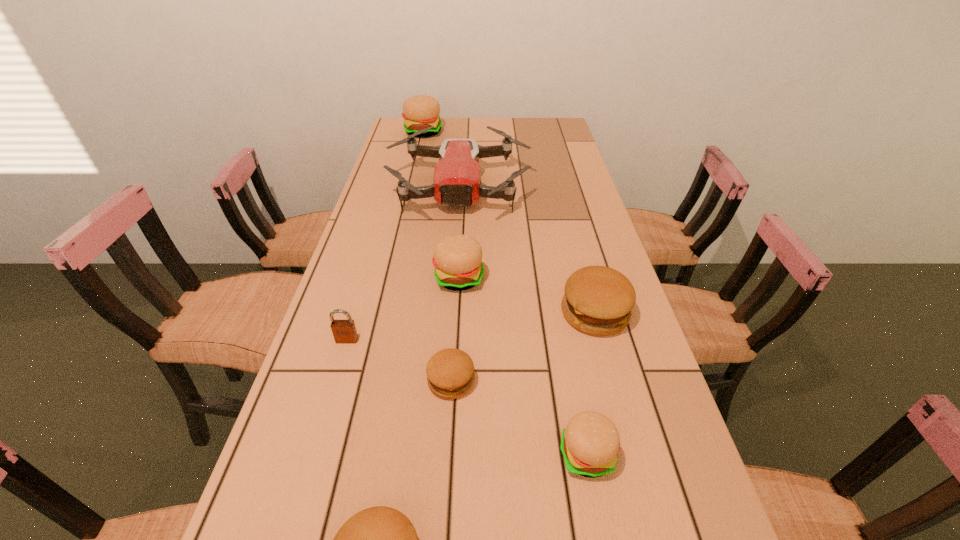
The width and height of the screenshot is (960, 540). I want to click on the nearest beige hamburger, so (x=590, y=442).

Find the location of a particular element. This screenshot has width=960, height=540. the shortest hamburger is located at coordinates (450, 372).

Where is `the third nearest hamburger`? The width and height of the screenshot is (960, 540). the third nearest hamburger is located at coordinates (450, 372).

This screenshot has height=540, width=960. What are the coordinates of `free space located on the front of the farthest object` in the screenshot? It's located at (416, 164).

Find the location of a particular element. The height and width of the screenshot is (540, 960). free spot located on the front-facing side of the red drone is located at coordinates (455, 249).

The image size is (960, 540). Identify the location of vacant region located 0.370m on the front of the second smallest beige hamburger. (450, 430).

At what (x,y) coordinates should I click in order to perform the action: click on free space located 0.060m on the left of the biggest brown hamburger. Please return your answer as a coordinate pair (x, y). The image size is (960, 540). Looking at the image, I should click on tap(536, 313).

Image resolution: width=960 pixels, height=540 pixels. Identify the location of free point located on the front-facing side of the padlock. (328, 402).

Locate an element on the screen. The height and width of the screenshot is (540, 960). free space located on the right of the fifth farthest hamburger is located at coordinates pos(687,455).

The height and width of the screenshot is (540, 960). I want to click on free point located 0.350m on the right of the second nearest brown hamburger, so click(x=644, y=381).